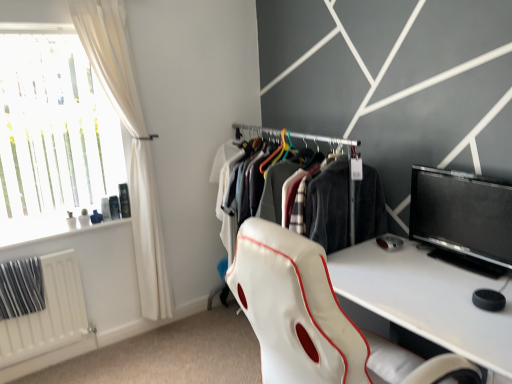
This screenshot has width=512, height=384. Find the location of `vacant region below black glossy monitor at right (from a real-world perspective)`. vacant region below black glossy monitor at right (from a real-world perspective) is located at coordinates (461, 264).